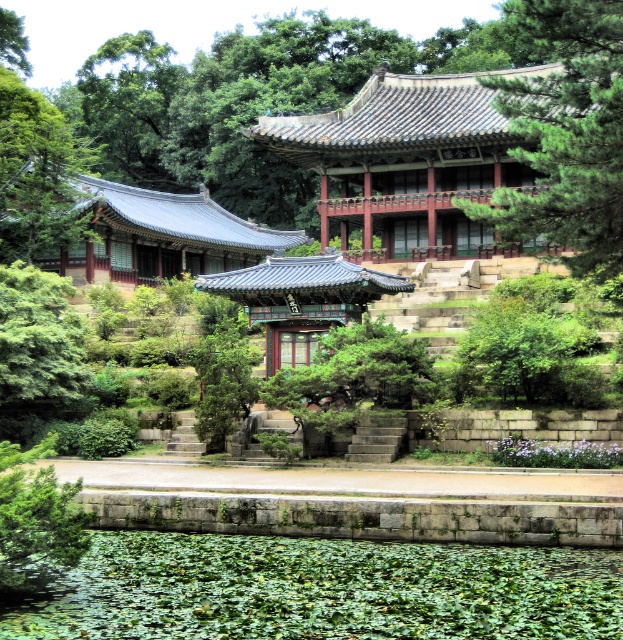
Is green textured pine tree at upper right taller than green leafy tree at upper left?

Indeed, green textured pine tree at upper right has a greater height compared to green leafy tree at upper left.

Measure the distance between point (607, 96) and camera.

Point (607, 96) and camera are 119.78 feet apart.

Between point (586, 150) and point (140, 170), which one is positioned behind?

The point (140, 170) is more distant.

Locate an element on the screen. green textured pine tree at upper right is located at coordinates (566, 131).

Can you confirm if green leafy water at lower center is smaller than green leafy tree at upper left?

Indeed, green leafy water at lower center has a smaller size compared to green leafy tree at upper left.

Is the position of green leafy water at lower center more distant than that of green leafy tree at upper left?

No, it is in front of green leafy tree at upper left.

Between point (376, 577) and point (93, 136), which one is positioned in front?

Positioned in front is point (376, 577).

Locate an element on the screen. green leafy water at lower center is located at coordinates (321, 589).

Does point (189, 614) come behind point (515, 224)?

No, it is not.

Which is in front, point (2, 628) or point (586, 58)?

Point (2, 628) is in front.

Image resolution: width=623 pixels, height=640 pixels. Identify the location of green leafy water at lower center. [x=321, y=589].